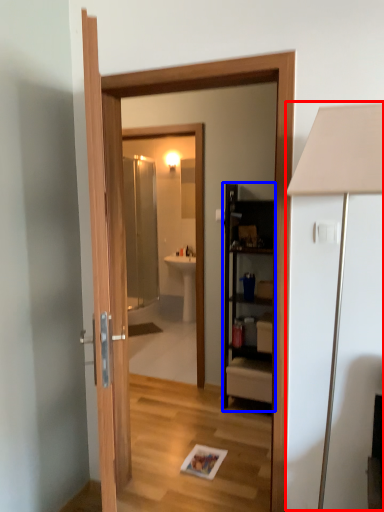
Question: Which point is closer to the camera, table lamp (highlighted by a red box) or cabinetry (highlighted by a blue box)?

Choices:
 (A) table lamp
 (B) cabinetry

Answer: (A)